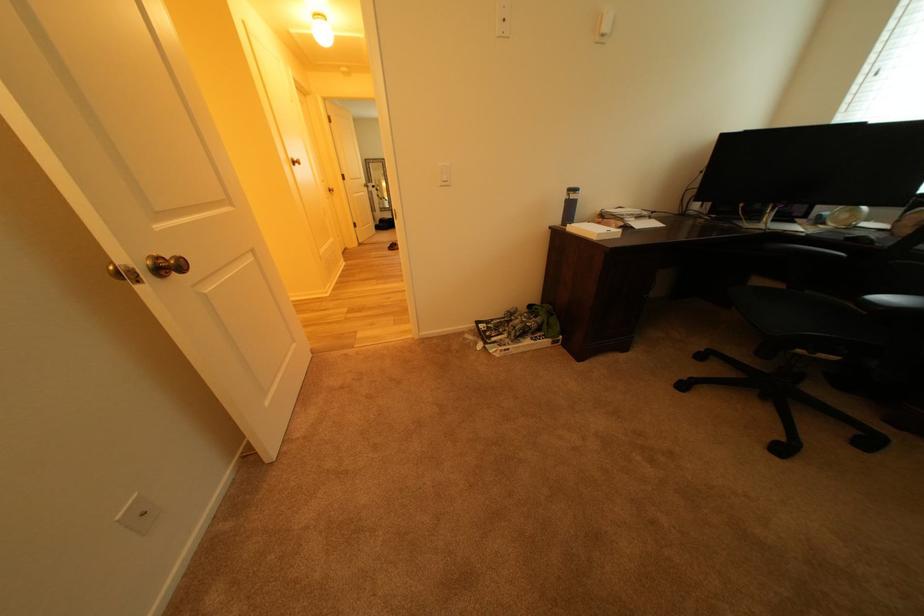
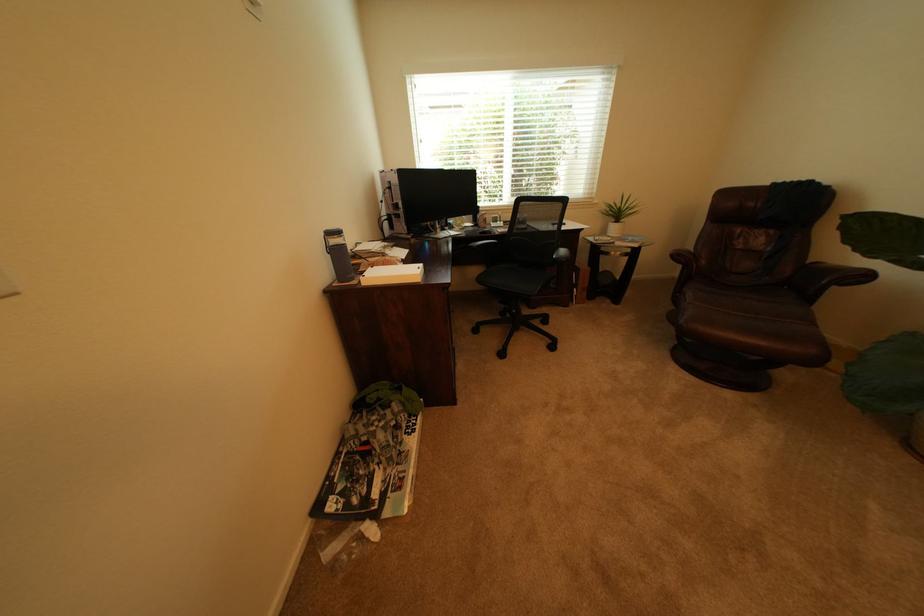
Find the pixel in the second image that matches (x=892, y=232) in the first image.

(482, 228)